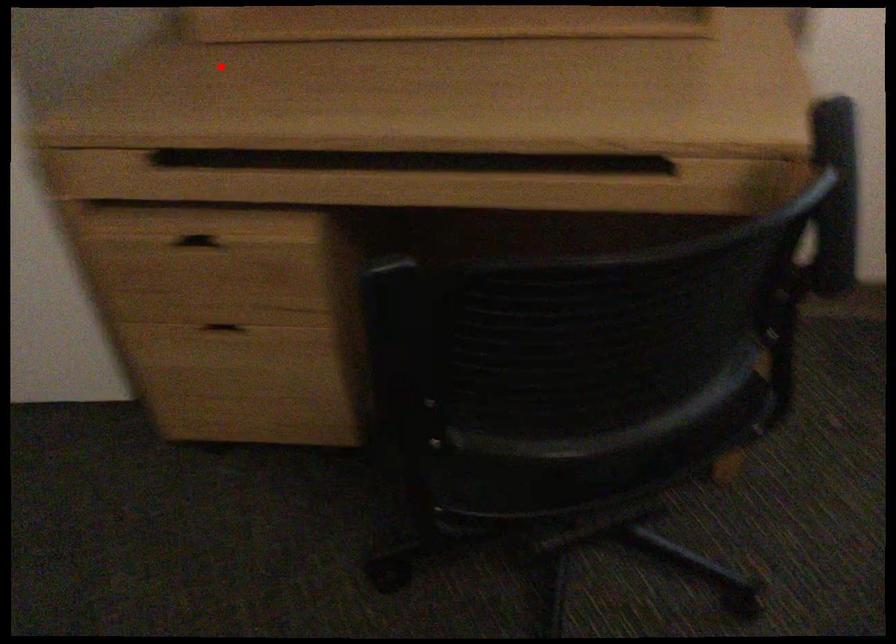
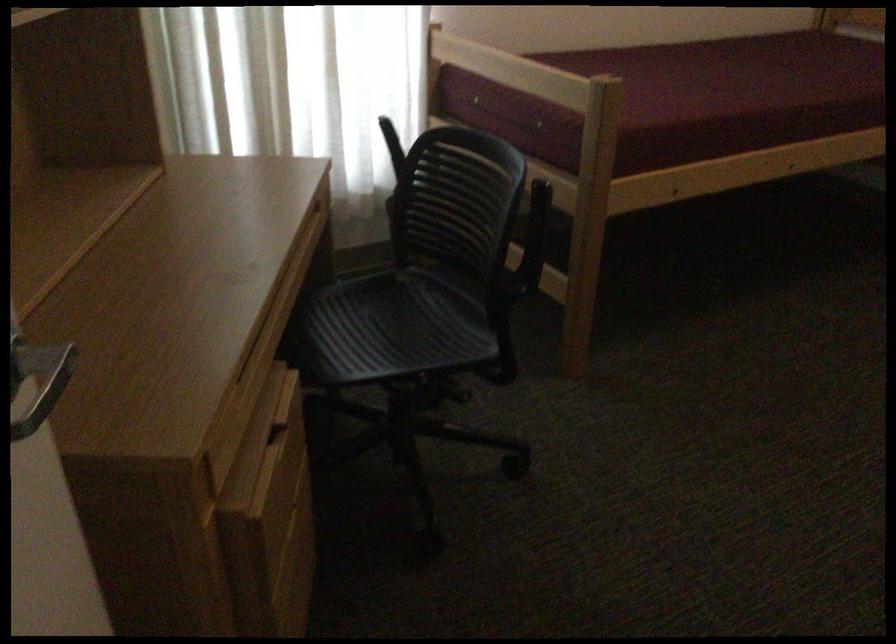
Where in the second image is the point corresponding to the highlighted location from the first image?

(55, 380)